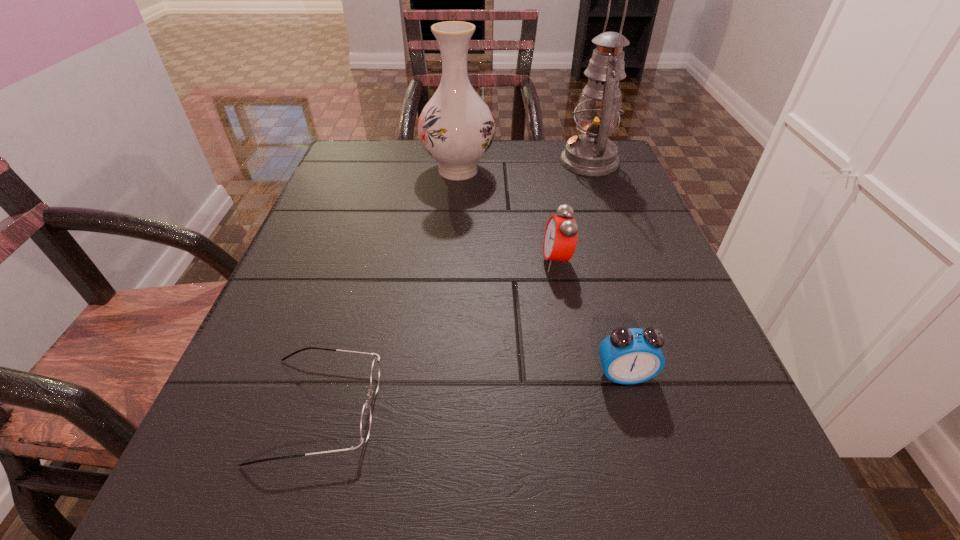
What are the coordinates of `free point located on the front-facing side of the farther alarm clock` in the screenshot? It's located at (339, 261).

Locate an element on the screen. The width and height of the screenshot is (960, 540). vacant area located 0.100m on the face of the nearer alarm clock is located at coordinates (648, 457).

Where is `free space located through the lenses of the shortest object`? Image resolution: width=960 pixels, height=540 pixels. free space located through the lenses of the shortest object is located at coordinates (415, 409).

Locate an element on the screen. oil lamp that is positioned at the far edge is located at coordinates (592, 153).

Identify the location of vase that is at the far edge. (456, 127).

Find the location of a particular element. The height and width of the screenshot is (540, 960). object that is at the near edge is located at coordinates (365, 424).

Where is `object present at the left edge`? object present at the left edge is located at coordinates (365, 424).

At what (x,y) coordinates should I click in order to perform the action: click on oil lamp present at the right edge. Please return your answer as a coordinate pair (x, y). This screenshot has width=960, height=540. Looking at the image, I should click on (592, 153).

Locate an element on the screen. alarm clock present at the right edge is located at coordinates (628, 356).

The height and width of the screenshot is (540, 960). Find the location of `object that is at the near left corner`. object that is at the near left corner is located at coordinates (365, 424).